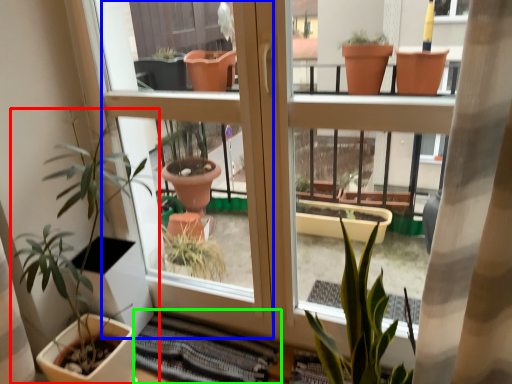
Question: Estimate the real-world distances between objects in this image. Which object is farther from houseplant (highlighted by a red box), screen door (highlighted by a blue box) or atrium (highlighted by a green box)?

Choices:
 (A) screen door
 (B) atrium

Answer: (B)